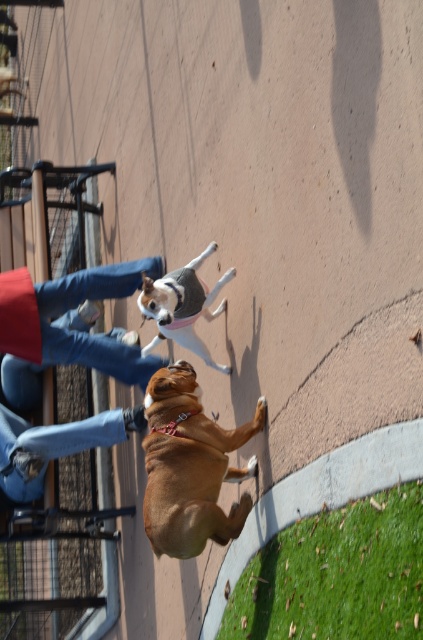
Based on the photo, can you confirm if denim pants at center is bigger than jeans at lower left?

Correct, denim pants at center is larger in size than jeans at lower left.

Who is higher up, denim pants at center or jeans at lower left?

Positioned higher is denim pants at center.

Is point (159, 266) less distant than point (10, 493)?

Yes, it is in front of point (10, 493).

Find the location of a particular element. Image resolution: width=423 pixels, height=640 pixels. denim pants at center is located at coordinates (90, 333).

What do you see at coordinates (189, 467) in the screenshot?
I see `brown leather dog at center` at bounding box center [189, 467].

Consider the image. Can you confirm if brown leather dog at center is wider than denim pants at center?

Incorrect, brown leather dog at center's width does not surpass denim pants at center's.

Who is more forward, (x=175, y=406) or (x=60, y=355)?

Point (x=175, y=406) is more forward.

Where is `brown leather dog at center`? The width and height of the screenshot is (423, 640). brown leather dog at center is located at coordinates (189, 467).

Which is more to the left, brown leather dog at center or soft gray sweater at center?

soft gray sweater at center

Does brown leather dog at center have a lesser width compared to soft gray sweater at center?

No.

Does point (169, 484) come closer to viewer compared to point (161, 289)?

Yes, point (169, 484) is in front of point (161, 289).

I want to click on brown leather dog at center, so click(189, 467).